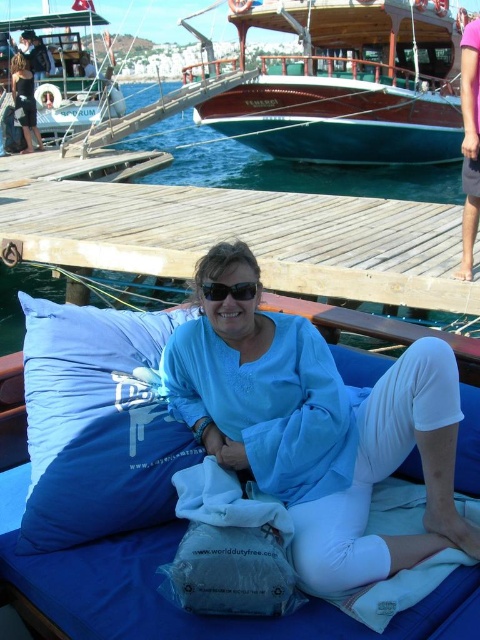
Between blue cotton shirt at center and black plastic sunglasses at center, which one is positioned higher?

black plastic sunglasses at center is above.

Is blue cotton shirt at center to the right of black plastic sunglasses at center from the viewer's perspective?

Indeed, blue cotton shirt at center is positioned on the right side of black plastic sunglasses at center.

Is point (317, 490) positioned behind point (214, 284)?

No.

In order to click on blue cotton shirt at center in this screenshot , I will do `click(316, 428)`.

Is blue fabric pillow at center below wooden boat at upper left?

Yes.

Locate an element on the screen. blue fabric pillow at center is located at coordinates (97, 422).

Which is behind, point (82, 358) or point (84, 13)?

The point (84, 13) is behind.

Where is `blue fabric pillow at center`? blue fabric pillow at center is located at coordinates (97, 422).

Which is above, wooden polished boat at upper center or black fabric dress at upper left?

wooden polished boat at upper center is higher up.

Which is more to the left, wooden polished boat at upper center or black fabric dress at upper left?

black fabric dress at upper left is more to the left.

The image size is (480, 640). What are the coordinates of `wooden polished boat at upper center` in the screenshot? It's located at (348, 83).

Identify the location of wooden polished boat at upper center. (348, 83).